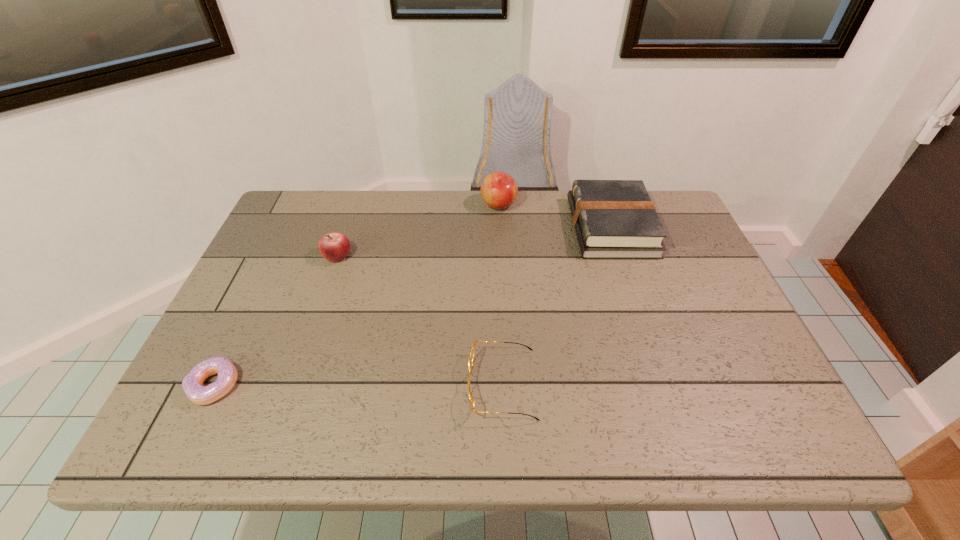
The image size is (960, 540). I want to click on free space between the farther apple and the shortest object, so click(356, 295).

Locate which object is the closest to the second shortest object. Please provide its 2D coordinates. Your answer should be formatted as a tuple, i.e. [(x, y)], where the tuple contains the x and y coordinates of a point satisfying the conditions above.

[(614, 219)]

Identify the location of the fourth closest object to the rightmost object. This screenshot has height=540, width=960. (192, 384).

At what (x,y) coordinates should I click in order to perform the action: click on free space that satisfies the following two spatial constraints: 1. on the front-facing side of the second shortest object; 2. on the front side of the shortest object. Please return your answer as a coordinate pair (x, y). Looking at the image, I should click on (502, 386).

The image size is (960, 540). Find the location of `vacant space that satisfies the following two spatial constraints: 1. on the back side of the farther apple; 2. on the right side of the fourth object from right to left`. vacant space that satisfies the following two spatial constraints: 1. on the back side of the farther apple; 2. on the right side of the fourth object from right to left is located at coordinates (354, 205).